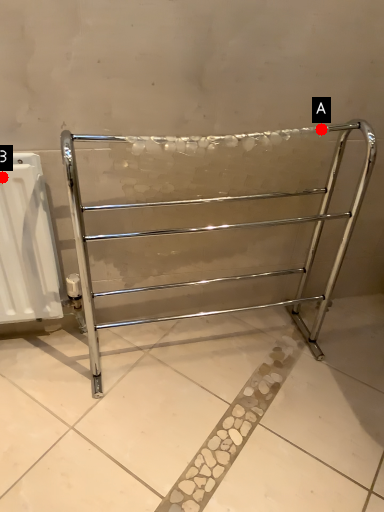
Question: Two points are circled on the image, labeled by A and B beside each circle. Among these points, which one is farthest from the camera?

Choices:
 (A) A is further
 (B) B is further

Answer: (A)